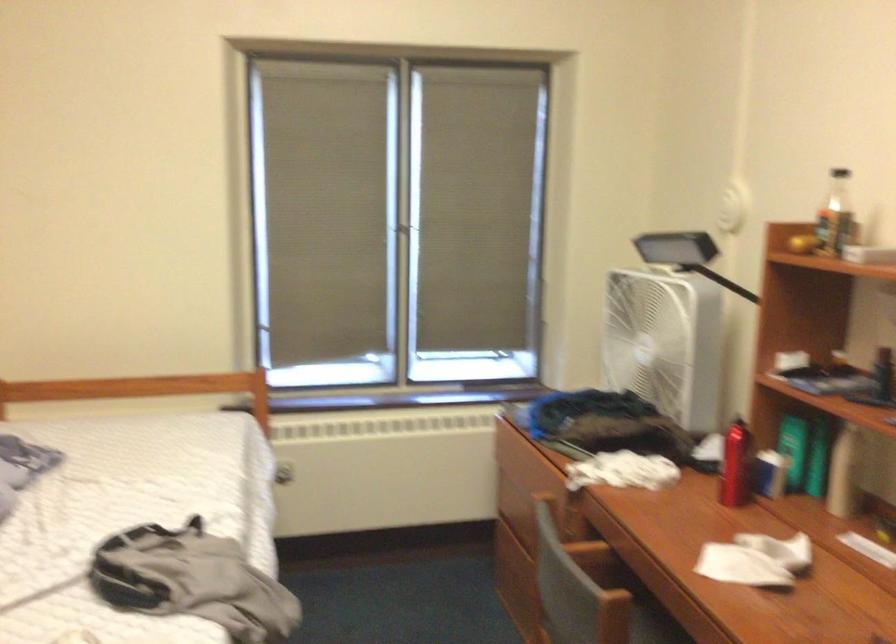
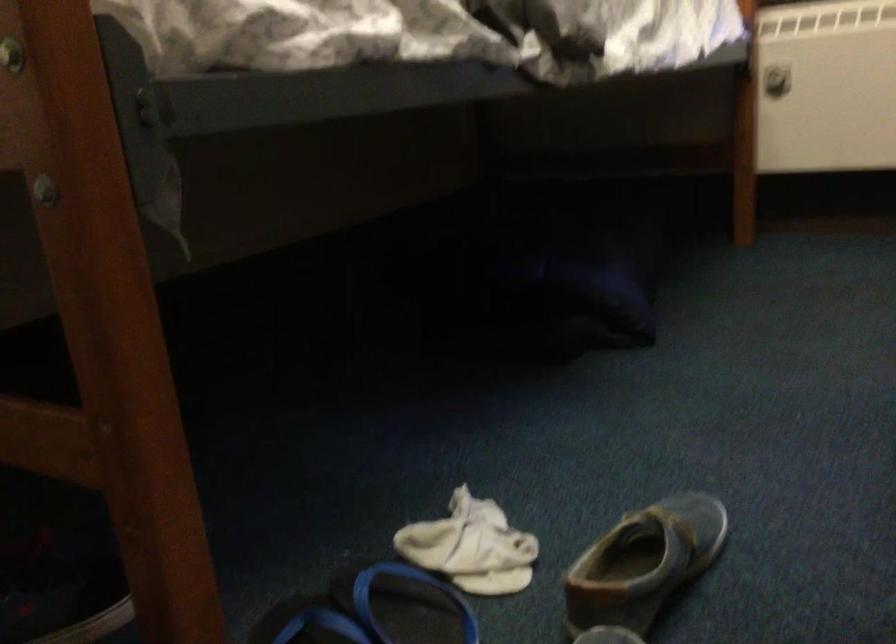
Where in the second image is the point corresponding to (291,477) from the first image?

(776, 80)